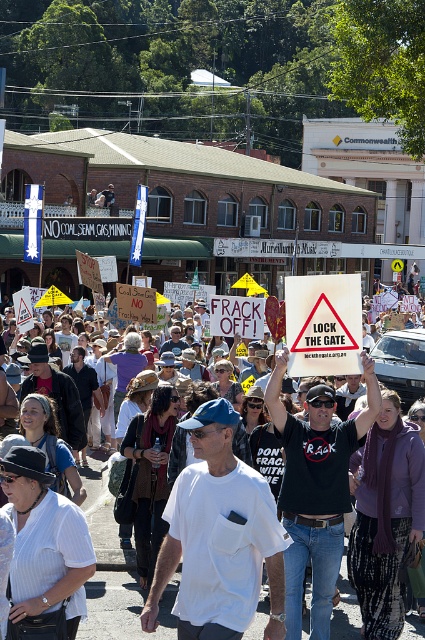
Question: Which of these objects is positioned farthest from the white cotton shirt at center?

Choices:
 (A) black cotton t-shirt at center
 (B) white paper placard at center

Answer: (B)

Question: Can you confirm if black cotton t-shirt at center is positioned above white cotton shirt at center?

Choices:
 (A) yes
 (B) no

Answer: (A)

Question: Observing the image, what is the correct spatial positioning of black cotton t-shirt at center in reference to white paper placard at center?

Choices:
 (A) below
 (B) above

Answer: (A)

Question: In this image, where is black cotton t-shirt at center located relative to white cotton shirt at center?

Choices:
 (A) below
 (B) above

Answer: (B)

Question: Which is farther from the black cotton t-shirt at center?

Choices:
 (A) white cotton shirt at center
 (B) white paper placard at center

Answer: (A)

Question: Which of the following is the farthest from the observer?

Choices:
 (A) white cotton shirt at center
 (B) white paper placard at center

Answer: (A)